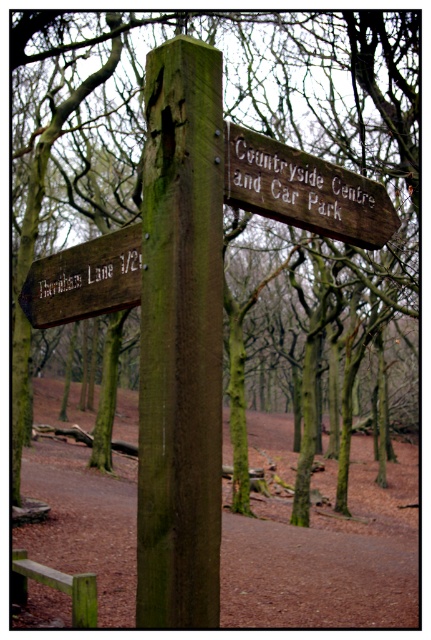
Question: Estimate the real-world distances between objects in this image. Which object is closer to the wooden sign at left?

Choices:
 (A) green rough wood post at center
 (B) green rough wooden bench at lower left

Answer: (A)

Question: Which point is farther to the camera?

Choices:
 (A) (52, 300)
 (B) (87, 257)
 (C) (252, 170)
 (D) (200, 499)

Answer: (A)

Question: Where is dark brown wood signpost at left located in relation to green rough wooden bench at lower left in the image?

Choices:
 (A) below
 (B) above

Answer: (B)

Question: Can you confirm if green rough wood post at center is wider than green rough wooden bench at lower left?

Choices:
 (A) yes
 (B) no

Answer: (B)

Question: Does dark brown wood signpost at left appear over green rough wooden bench at lower left?

Choices:
 (A) yes
 (B) no

Answer: (A)

Question: Considering the real-world distances, which object is closest to the wooden sign at left?

Choices:
 (A) dark brown wood signpost at left
 (B) green rough wooden bench at lower left
 (C) wooden sign at upper center

Answer: (A)